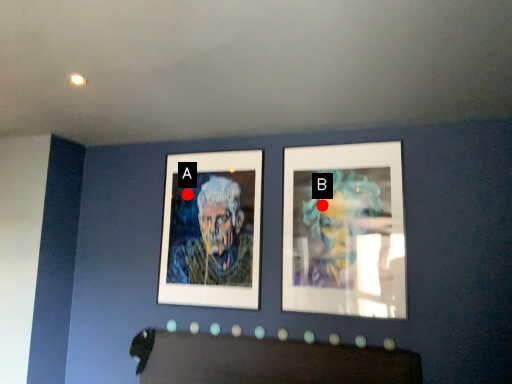
Question: Two points are circled on the image, labeled by A and B beside each circle. Which point is further to the camera?

Choices:
 (A) A is further
 (B) B is further

Answer: (A)